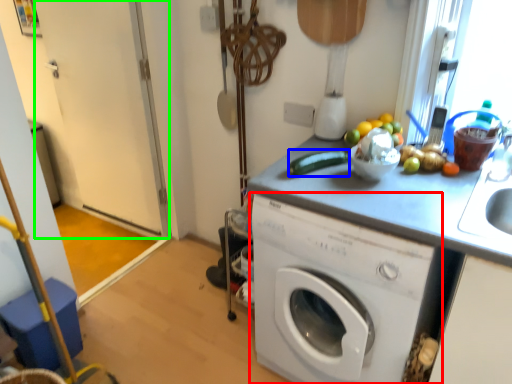
Question: Which object is the farthest from washing machine (highlighted by a red box)? Choose among these: vegetable (highlighted by a blue box) or screen door (highlighted by a green box).

Choices:
 (A) vegetable
 (B) screen door

Answer: (B)